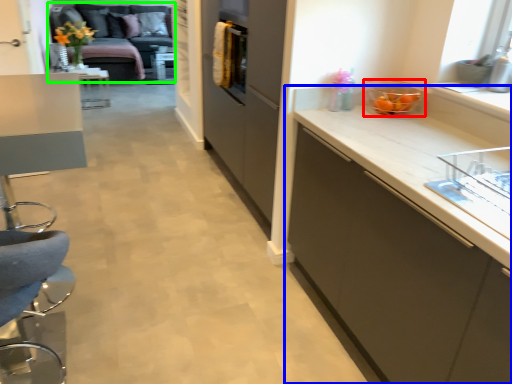
Question: Estimate the real-world distances between objects in this image. Which object is closer to appliance (highlighted by a red box), cabinetry (highlighted by a blue box) or studio couch (highlighted by a green box)?

Choices:
 (A) cabinetry
 (B) studio couch

Answer: (A)